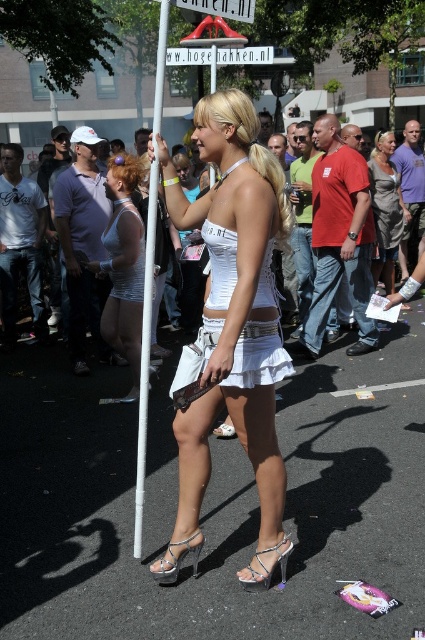
Based on the photo, you are a photographer positioned at the origin point of the image. The white satin dress at center is at coordinates 0.481, 0.548. If you want to capture a closeup of the dress without including the signpost, which direction should you move your camera? Please answer with either left, right, up, or down.

The white satin dress at center is located at point (232,307). To avoid the signpost, you should move the camera slightly to the left or right, depending on the signpost position. However, since the signpost is part of the pole she holds, moving left or right might still include it. Alternatively, moving up or down could frame the dress better. Without exact signpost coordinates, the safest direction is up or down to avoid the pole.

What object is located at the coordinates point (x=271, y=566) in the image?

The point (x=271, y=566) corresponds to the clear crystal sandal at lower center.

You are a photographer at the event and want to capture both the white satin dress at center and the silky gray dress at center in a single shot. Which dress should you focus on first to ensure both are in frame?

The white satin dress at center is positioned under the silky gray dress at center, so you should focus on the silky gray dress at center first to ensure both are in frame.